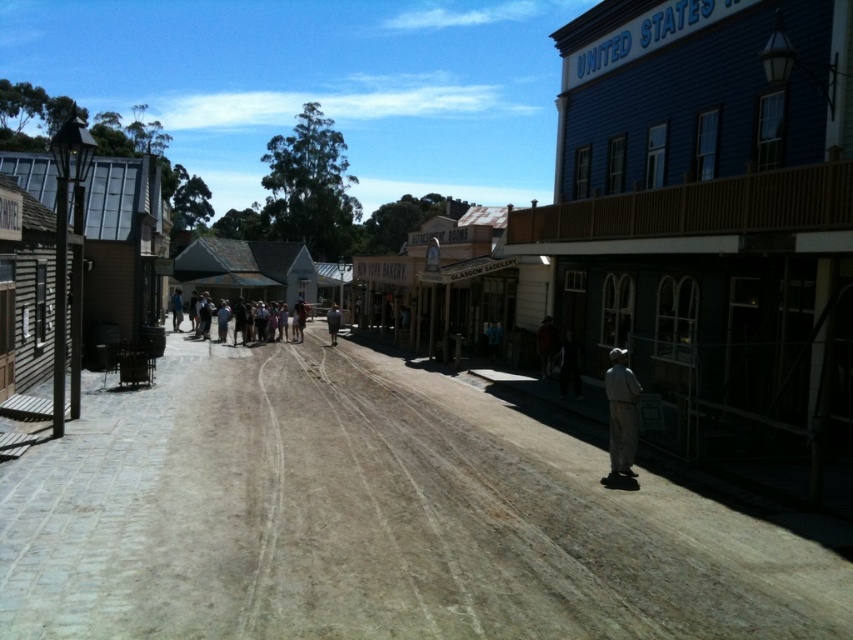
Question: Among these points, which one is farthest from the camera?

Choices:
 (A) (543, 360)
 (B) (334, 314)
 (C) (228, 301)
 (D) (624, 401)

Answer: (C)

Question: Estimate the real-world distances between objects in this image. Which object is closer to the brown leather jacket at center?

Choices:
 (A) dark gray fabric jacket at center
 (B) gray fabric pants at lower right
 (C) light blue denim jacket at center

Answer: (B)

Question: Can you confirm if brown dusty dirt track at center is positioned below gray fabric pants at lower right?

Choices:
 (A) no
 (B) yes

Answer: (B)

Question: Can you confirm if brown dusty dirt track at center is positioned above dark gray fabric jacket at center?

Choices:
 (A) yes
 (B) no

Answer: (B)

Question: Is brown dusty dirt track at center bigger than dark gray fabric jacket at center?

Choices:
 (A) no
 (B) yes

Answer: (A)

Question: Which point is closer to the camera?

Choices:
 (A) gray fabric pants at lower right
 (B) brown leather jacket at center
 (C) dark gray fabric jacket at center
 (D) light blue denim jacket at center

Answer: (A)